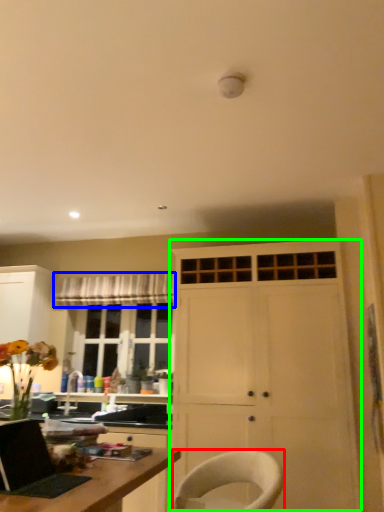
Question: Which object is positioned farthest from chair (highlighted by a red box)? Select from curtain (highlighted by a blue box) and cabinetry (highlighted by a green box).

Choices:
 (A) curtain
 (B) cabinetry

Answer: (A)